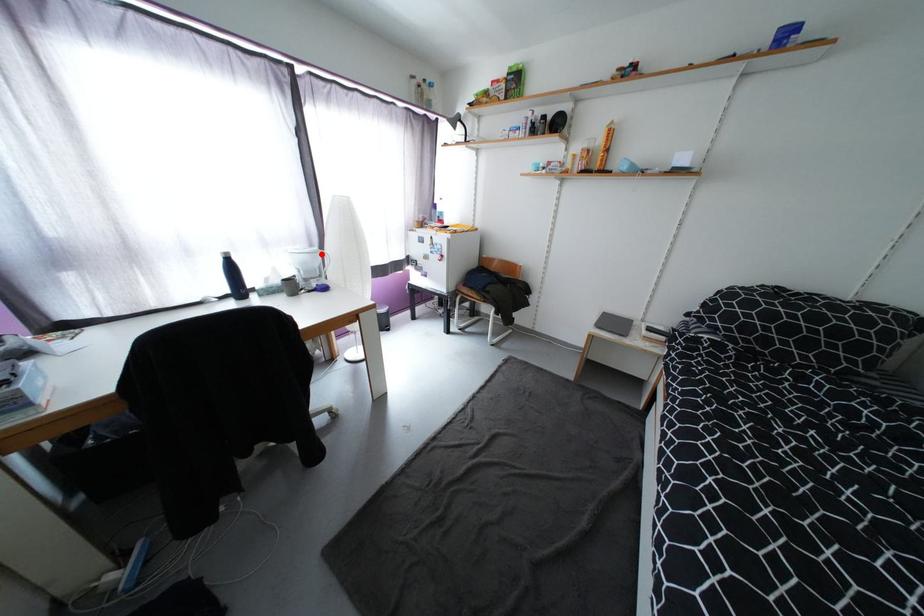
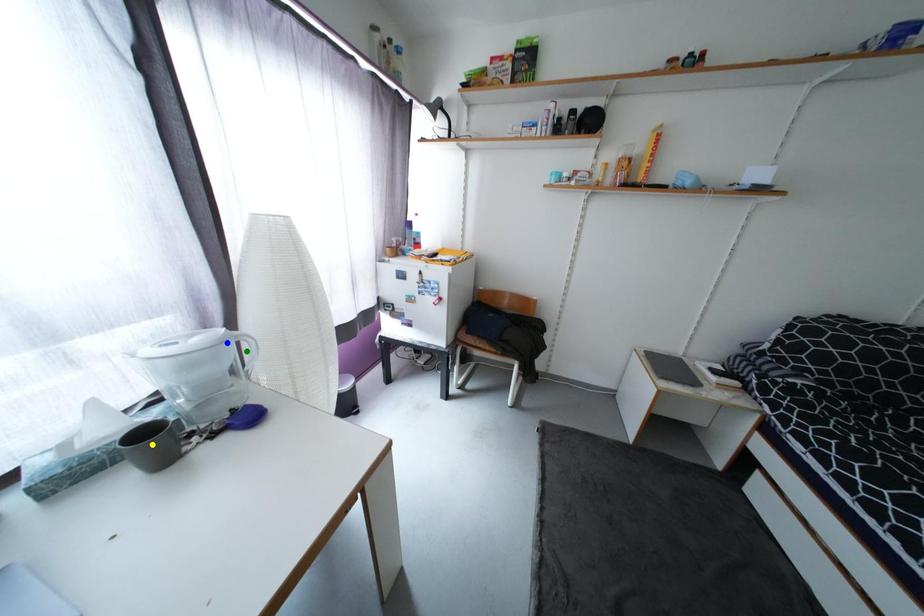
Question: I am providing you with two images of the same scene from different viewpoints. A red point is marked on the first image. You are given multiple points on the second image. Which point in image 2 represents the same 3d spot as the red point in image 1?

Choices:
 (A) blue point
 (B) yellow point
 (C) green point

Answer: (A)